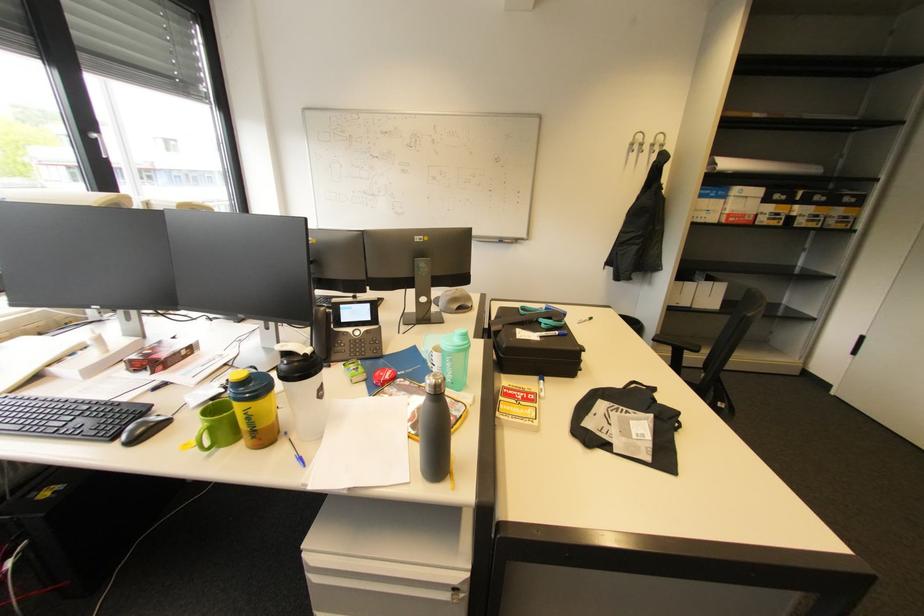
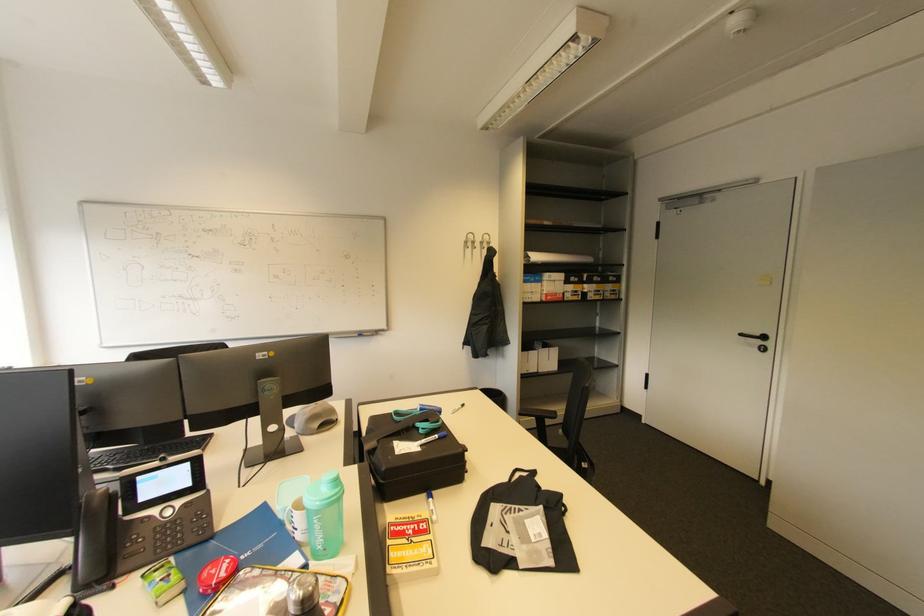
Locate, in the second image, the point that corresponds to [523,339] in the first image.

(402, 455)